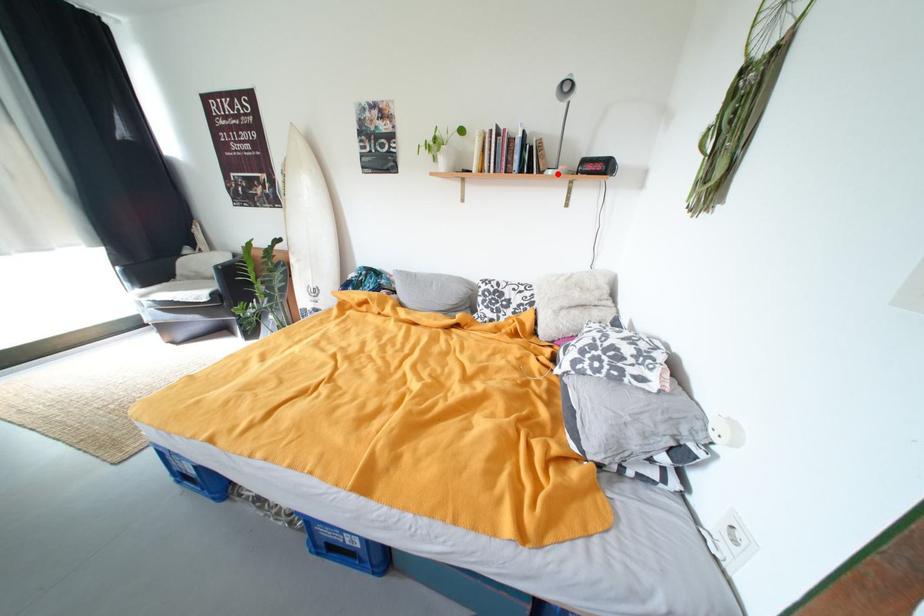
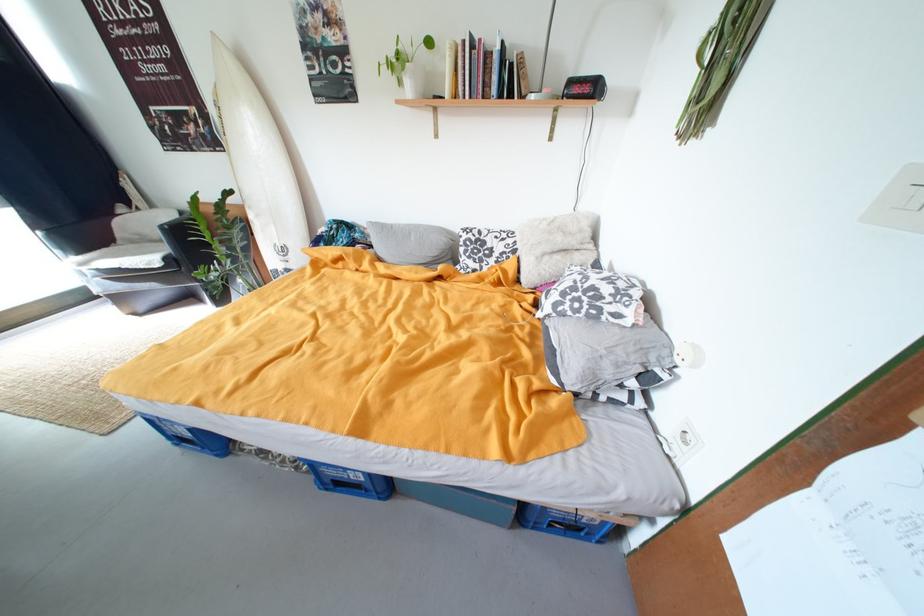
Find the pixel in the second image that matches the highlighted location in the first image.

(541, 99)